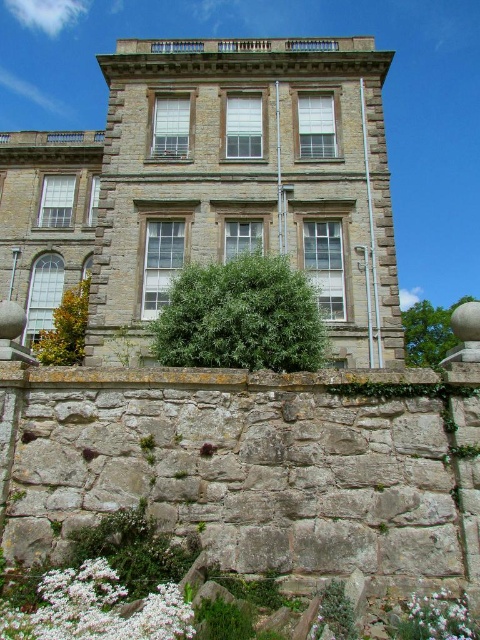
Is white fluffy flower at lower left wider than white matte flower at lower right?

Correct, the width of white fluffy flower at lower left exceeds that of white matte flower at lower right.

Which of these two, white fluffy flower at lower left or white matte flower at lower right, stands taller?

With more height is white fluffy flower at lower left.

Is point (74, 584) positioned after point (466, 612)?

Yes, it is behind point (466, 612).

At what (x,y) coordinates should I click in order to perform the action: click on white fluffy flower at lower left. Please return your answer as a coordinate pair (x, y). This screenshot has width=480, height=640. Looking at the image, I should click on (96, 609).